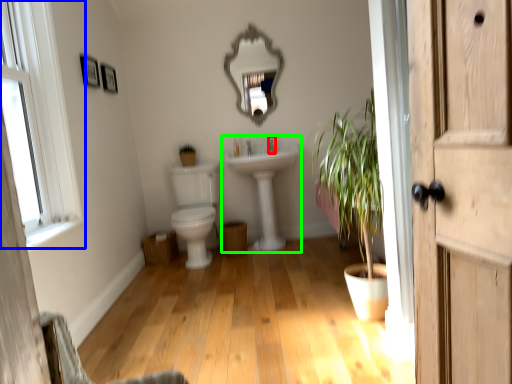
Question: Estimate the real-world distances between objects in this image. Which object is farther from faucet (highlighted by a red box), window (highlighted by a blue box) or sink (highlighted by a green box)?

Choices:
 (A) window
 (B) sink

Answer: (A)